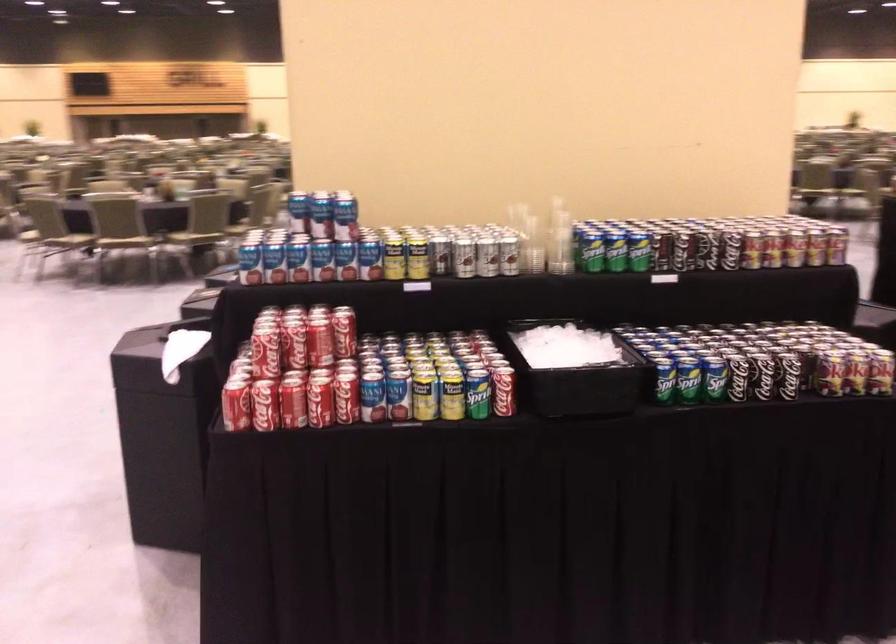
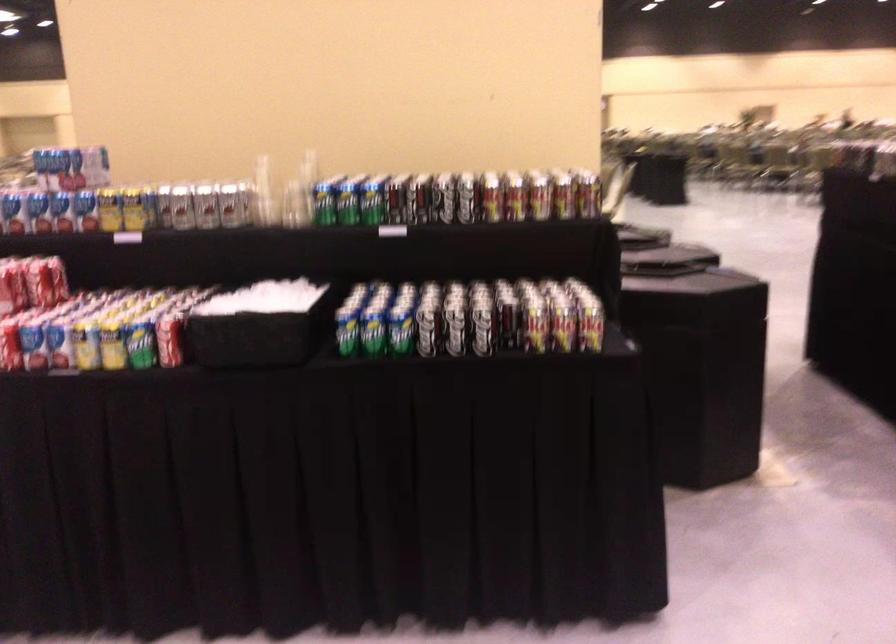
Locate, in the second image, the point that corresponds to (343,261) in the first image.

(61, 211)